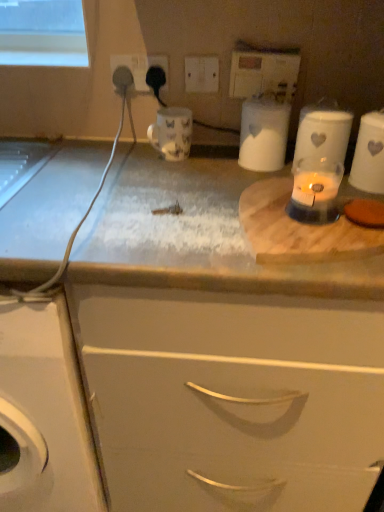
In order to click on vacant region to the left of matte ceramic mug at center, which is counted as the first appliance, starting from the left in this screenshot , I will do `click(132, 159)`.